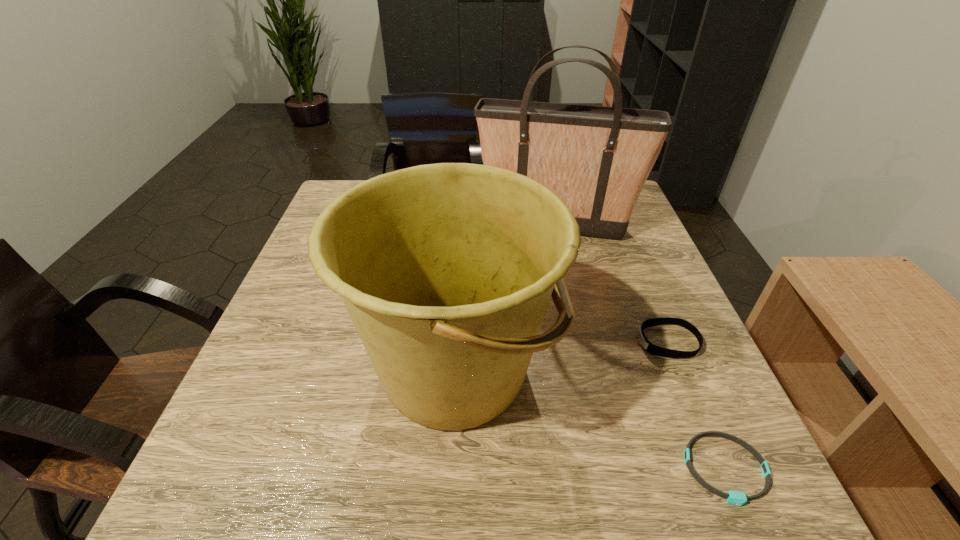
Image resolution: width=960 pixels, height=540 pixels. What are the coordinates of `vacant region at the near left corner of the desktop` in the screenshot? It's located at (215, 468).

You are a GUI agent. You are given a task and a screenshot of the screen. Output one action in this format:
    pyautogui.click(x=<x>, y=<y>)
    Task: Click on the free space between the taller wristband and the farthest object
    
    Given the screenshot: What is the action you would take?
    pyautogui.click(x=612, y=284)

You are a GUI agent. You are given a task and a screenshot of the screen. Output one action in this format:
    pyautogui.click(x=<x>, y=<y>)
    Task: Click on the empty space that is in between the bucket and the nearer wristband
    Image resolution: width=960 pixels, height=540 pixels.
    Given the screenshot: What is the action you would take?
    590,419

Where is `vacant area between the shorter wristband and the tallest object`? vacant area between the shorter wristband and the tallest object is located at coordinates (640, 348).

Find the location of a particular element. Image resolution: width=960 pixels, height=540 pixels. free space between the shopping bag and the nearer wristband is located at coordinates (640, 348).

Image resolution: width=960 pixels, height=540 pixels. I want to click on empty location between the tallest object and the shorter wristband, so click(640, 348).

Locate an element on the screen. This screenshot has width=960, height=540. empty location between the second tallest object and the shortest object is located at coordinates (590, 419).

Identify the location of vacant space that is in between the tallest object and the taller wristband. The height and width of the screenshot is (540, 960). (612, 284).

Locate which object ranks in proximity to the shorter wristband. Please provide its 2D coordinates. Your answer should be formatted as a tuple, i.e. [(x, y)], where the tuple contains the x and y coordinates of a point satisfying the conditions above.

[(652, 349)]

The height and width of the screenshot is (540, 960). Identify the location of object that stands as the closest to the shorter wristband. (652, 349).